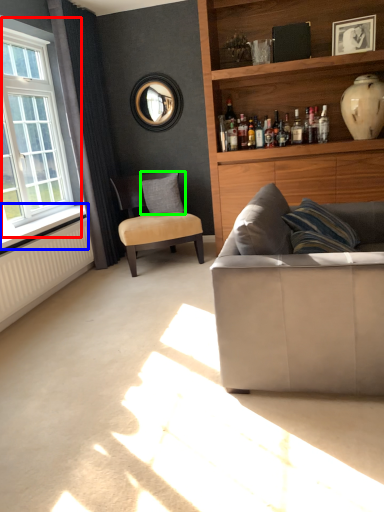
Question: Estimate the real-world distances between objects in this image. Which object is closer to window (highlighted by a red box), window sill (highlighted by a blue box) or pillow (highlighted by a green box)?

Choices:
 (A) window sill
 (B) pillow

Answer: (A)